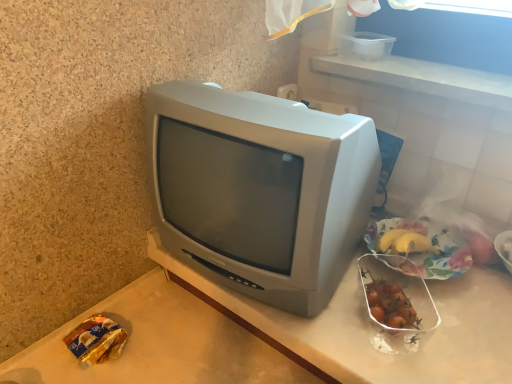
This screenshot has height=384, width=512. What are the coordinates of `translucent plastic banana at upper right, the 1th food positioned from the right` in the screenshot? It's located at (507, 249).

Describe the element at coordinates (96, 340) in the screenshot. The height and width of the screenshot is (384, 512). I see `gold foil snack at lower left, the 4th food when ordered from right to left` at that location.

Locate an element on the screen. This screenshot has width=512, height=384. matte gray television at center is located at coordinates (260, 189).

From a real-world perspective, is matte gray television at center over yellow matte bananas at right, the third food in the left-to-right sequence?

Indeed, from a real-world perspective, matte gray television at center stands above yellow matte bananas at right, the third food in the left-to-right sequence.

Which object is wider, matte gray television at center or yellow matte bananas at right, which appears as the second food when viewed from the right?

With larger width is matte gray television at center.

Consider the image. Measure the distance between gold foil snack at lower left, the 4th food when ordered from right to left, and yellow matte bananas at right, the third food in the left-to-right sequence.

gold foil snack at lower left, the 4th food when ordered from right to left, is 24.89 inches from yellow matte bananas at right, the third food in the left-to-right sequence.

From a real-world perspective, does gold foil snack at lower left, the 4th food when ordered from right to left, stand above yellow matte bananas at right, the third food in the left-to-right sequence?

Incorrect, from a real-world perspective, gold foil snack at lower left, the 4th food when ordered from right to left, is lower than yellow matte bananas at right, the third food in the left-to-right sequence.

Does gold foil snack at lower left, placed as the 1th food when sorted from left to right, turn towards yellow matte bananas at right, the third food in the left-to-right sequence?

No, gold foil snack at lower left, placed as the 1th food when sorted from left to right, is not turned towards yellow matte bananas at right, the third food in the left-to-right sequence.

Which point is more forward, (105, 319) or (430, 239)?

The point (105, 319) is closer.

Could you measure the distance between matte gray television at center and shiny plastic container of cherry tomatoes at right, arranged as the second food when viewed from the left?

The distance of matte gray television at center from shiny plastic container of cherry tomatoes at right, arranged as the second food when viewed from the left, is 11.91 inches.

Is matte gray television at center in contact with shiny plastic container of cherry tomatoes at right, the third food in the right-to-left sequence?

No, matte gray television at center is not with shiny plastic container of cherry tomatoes at right, the third food in the right-to-left sequence.

How many degrees apart are the facing directions of matte gray television at center and shiny plastic container of cherry tomatoes at right, the third food in the right-to-left sequence?

35.4 degrees separate the facing orientations of matte gray television at center and shiny plastic container of cherry tomatoes at right, the third food in the right-to-left sequence.

Does matte gray television at center contain shiny plastic container of cherry tomatoes at right, arranged as the second food when viewed from the left?

No.

Is yellow matte bananas at right, which appears as the second food when viewed from the right, with matte gray television at center?

No, yellow matte bananas at right, which appears as the second food when viewed from the right, is not with matte gray television at center.

Is point (419, 219) closer or farther from the camera than point (276, 173)?

Point (419, 219).

Considering the sizes of objects yellow matte bananas at right, which appears as the second food when viewed from the right, and matte gray television at center in the image provided, who is shorter, yellow matte bananas at right, which appears as the second food when viewed from the right, or matte gray television at center?

Standing shorter between the two is yellow matte bananas at right, which appears as the second food when viewed from the right.

Does matte gray television at center turn towards gold foil snack at lower left, placed as the 1th food when sorted from left to right?

No, matte gray television at center is not aimed at gold foil snack at lower left, placed as the 1th food when sorted from left to right.

Between matte gray television at center and gold foil snack at lower left, placed as the 1th food when sorted from left to right, which one has less height?

Standing shorter between the two is gold foil snack at lower left, placed as the 1th food when sorted from left to right.

Between point (154, 161) and point (109, 324), which one is positioned behind?

The point (109, 324) is behind.

From the image's perspective, is translucent plastic banana at upper right, the 4th food positioned from the left, below shiny plastic container of cherry tomatoes at right, arranged as the second food when viewed from the left?

No, from the image's perspective, translucent plastic banana at upper right, the 4th food positioned from the left, is not below shiny plastic container of cherry tomatoes at right, arranged as the second food when viewed from the left.

Which of these two, translucent plastic banana at upper right, the 4th food positioned from the left, or shiny plastic container of cherry tomatoes at right, the third food in the right-to-left sequence, is wider?

With larger width is shiny plastic container of cherry tomatoes at right, the third food in the right-to-left sequence.

Considering the sizes of translucent plastic banana at upper right, the 1th food positioned from the right, and shiny plastic container of cherry tomatoes at right, the third food in the right-to-left sequence, in the image, is translucent plastic banana at upper right, the 1th food positioned from the right, taller or shorter than shiny plastic container of cherry tomatoes at right, the third food in the right-to-left sequence,?

translucent plastic banana at upper right, the 1th food positioned from the right, is taller than shiny plastic container of cherry tomatoes at right, the third food in the right-to-left sequence.

Can you confirm if translucent plastic banana at upper right, the 4th food positioned from the left, is bigger than shiny plastic container of cherry tomatoes at right, arranged as the second food when viewed from the left?

No, translucent plastic banana at upper right, the 4th food positioned from the left, is not bigger than shiny plastic container of cherry tomatoes at right, arranged as the second food when viewed from the left.

Is translucent plastic banana at upper right, the 1th food positioned from the right, shorter than matte gray television at center?

Indeed, translucent plastic banana at upper right, the 1th food positioned from the right, has a lesser height compared to matte gray television at center.

Where is `the 2nd food below the matte gray television at center (from a real-world perspective)`? Image resolution: width=512 pixels, height=384 pixels. the 2nd food below the matte gray television at center (from a real-world perspective) is located at coordinates (507, 249).

Considering the positions of objects translucent plastic banana at upper right, the 4th food positioned from the left, and matte gray television at center in the image provided, who is more to the right, translucent plastic banana at upper right, the 4th food positioned from the left, or matte gray television at center?

Positioned to the right is translucent plastic banana at upper right, the 4th food positioned from the left.

Image resolution: width=512 pixels, height=384 pixels. What are the coordinates of `the 2nd food to the right of the matte gray television at center, starting your count from the anchor` in the screenshot? It's located at (431, 244).

From a real-world perspective, which food is the 3rd one underneath the yellow matte bananas at right, the third food in the left-to-right sequence? Please provide its 2D coordinates.

[(96, 340)]

Looking at the image, which one is located further to yellow matte bananas at right, which appears as the second food when viewed from the right, translucent plastic banana at upper right, the 1th food positioned from the right, or shiny plastic container of cherry tomatoes at right, arranged as the second food when viewed from the left?

Based on the image, shiny plastic container of cherry tomatoes at right, arranged as the second food when viewed from the left, appears to be further to yellow matte bananas at right, which appears as the second food when viewed from the right.

Which object lies nearer to the anchor point shiny plastic container of cherry tomatoes at right, the third food in the right-to-left sequence, yellow matte bananas at right, which appears as the second food when viewed from the right, or translucent plastic banana at upper right, the 4th food positioned from the left?

yellow matte bananas at right, which appears as the second food when viewed from the right, is positioned closer to the anchor shiny plastic container of cherry tomatoes at right, the third food in the right-to-left sequence.

Based on their spatial positions, is matte gray television at center or yellow matte bananas at right, which appears as the second food when viewed from the right, further from shiny plastic container of cherry tomatoes at right, arranged as the second food when viewed from the left?

matte gray television at center.

Estimate the real-world distances between objects in this image. Which object is closer to yellow matte bananas at right, the third food in the left-to-right sequence, gold foil snack at lower left, placed as the 1th food when sorted from left to right, or translucent plastic banana at upper right, the 4th food positioned from the left?

Among the two, translucent plastic banana at upper right, the 4th food positioned from the left, is located nearer to yellow matte bananas at right, the third food in the left-to-right sequence.

When comparing their distances from yellow matte bananas at right, the third food in the left-to-right sequence, does translucent plastic banana at upper right, the 1th food positioned from the right, or gold foil snack at lower left, the 4th food when ordered from right to left, seem closer?

The object closer to yellow matte bananas at right, the third food in the left-to-right sequence, is translucent plastic banana at upper right, the 1th food positioned from the right.

Looking at the image, which one is located closer to yellow matte bananas at right, the third food in the left-to-right sequence, matte gray television at center or translucent plastic banana at upper right, the 4th food positioned from the left?

Among the two, translucent plastic banana at upper right, the 4th food positioned from the left, is located nearer to yellow matte bananas at right, the third food in the left-to-right sequence.

Estimate the real-world distances between objects in this image. Which object is further from shiny plastic container of cherry tomatoes at right, the third food in the right-to-left sequence, translucent plastic banana at upper right, the 1th food positioned from the right, or yellow matte bananas at right, the third food in the left-to-right sequence?

translucent plastic banana at upper right, the 1th food positioned from the right, is further to shiny plastic container of cherry tomatoes at right, the third food in the right-to-left sequence.

Considering their positions, is gold foil snack at lower left, placed as the 1th food when sorted from left to right, positioned closer to shiny plastic container of cherry tomatoes at right, the third food in the right-to-left sequence, than matte gray television at center?

matte gray television at center is closer to shiny plastic container of cherry tomatoes at right, the third food in the right-to-left sequence.

Find the location of a particular element. The height and width of the screenshot is (384, 512). television located between gold foil snack at lower left, placed as the 1th food when sorted from left to right, and shiny plastic container of cherry tomatoes at right, the third food in the right-to-left sequence, in the left-right direction is located at coordinates (260, 189).

Locate an element on the screen. food situated between shiny plastic container of cherry tomatoes at right, the third food in the right-to-left sequence, and translucent plastic banana at upper right, the 1th food positioned from the right, from left to right is located at coordinates (431, 244).

The width and height of the screenshot is (512, 384). Identify the location of food between matte gray television at center and yellow matte bananas at right, the third food in the left-to-right sequence, from left to right. (391, 305).

You are a GUI agent. You are given a task and a screenshot of the screen. Output one action in this format:
    pyautogui.click(x=<x>, y=<y>)
    Task: Click on the television located between gold foil snack at lower left, placed as the 1th food when sorted from left to right, and yellow matte bananas at right, the third food in the left-to-right sequence, in the left-right direction
    The height and width of the screenshot is (384, 512).
    Given the screenshot: What is the action you would take?
    pyautogui.click(x=260, y=189)